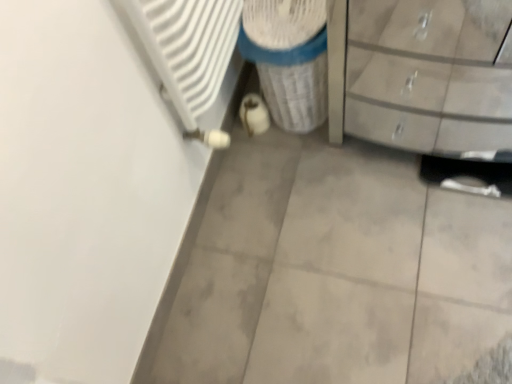
Find the location of a particular element. The image size is (512, 384). white textured cylinder at center is located at coordinates (292, 81).

Measure the distance between point (269, 99) and camera.

A distance of 1.59 meters exists between point (269, 99) and camera.

The height and width of the screenshot is (384, 512). What do you see at coordinates (292, 81) in the screenshot?
I see `white textured cylinder at center` at bounding box center [292, 81].

The width and height of the screenshot is (512, 384). What do you see at coordinates (423, 75) in the screenshot?
I see `matte gray chest of drawers at right` at bounding box center [423, 75].

Find the location of a particular element. This screenshot has width=512, height=384. matte gray chest of drawers at right is located at coordinates (423, 75).

The width and height of the screenshot is (512, 384). What are the coordinates of `white textured cylinder at center` in the screenshot? It's located at (292, 81).

Does matte gray chest of drawers at right appear on the right side of white textured cylinder at center?

Correct, you'll find matte gray chest of drawers at right to the right of white textured cylinder at center.

Does matte gray chest of drawers at right come behind white textured cylinder at center?

No, matte gray chest of drawers at right is closer to the viewer.

Which is in front, point (420, 18) or point (267, 63)?

Point (267, 63)

From the image's perspective, is matte gray chest of drawers at right over white textured cylinder at center?

No.

From a real-world perspective, which object stands above the other?

matte gray chest of drawers at right.

Is matte gray chest of drawers at right thinner than white textured cylinder at center?

Incorrect, the width of matte gray chest of drawers at right is not less than that of white textured cylinder at center.

Does matte gray chest of drawers at right have a lesser height compared to white textured cylinder at center?

In fact, matte gray chest of drawers at right may be taller than white textured cylinder at center.

Can you confirm if matte gray chest of drawers at right is bigger than white textured cylinder at center?

Correct, matte gray chest of drawers at right is larger in size than white textured cylinder at center.

Is matte gray chest of drawers at right not inside white textured cylinder at center?

Yes.

Is matte gray chest of drawers at right next to white textured cylinder at center?

No, matte gray chest of drawers at right is not touching white textured cylinder at center.

Is matte gray chest of drawers at right oriented towards white textured cylinder at center?

No, matte gray chest of drawers at right is not oriented towards white textured cylinder at center.

The height and width of the screenshot is (384, 512). Identify the location of chest of drawers below the white textured cylinder at center (from the image's perspective). (423, 75).

Would you say white textured cylinder at center is to the left or to the right of matte gray chest of drawers at right in the picture?

Based on their positions, white textured cylinder at center is located to the left of matte gray chest of drawers at right.

Does white textured cylinder at center lie in front of matte gray chest of drawers at right?

No, white textured cylinder at center is behind matte gray chest of drawers at right.

Is point (270, 86) closer or farther from the camera than point (442, 48)?

Point (270, 86) is closer to the camera than point (442, 48).

From the image's perspective, would you say white textured cylinder at center is positioned over matte gray chest of drawers at right?

Yes, from the image's perspective, white textured cylinder at center is over matte gray chest of drawers at right.

From a real-world perspective, does white textured cylinder at center stand above matte gray chest of drawers at right?

No, from a real-world perspective, white textured cylinder at center is not over matte gray chest of drawers at right

Between white textured cylinder at center and matte gray chest of drawers at right, which one has larger width?

Wider between the two is matte gray chest of drawers at right.

Is white textured cylinder at center taller than matte gray chest of drawers at right?

No.

Between white textured cylinder at center and matte gray chest of drawers at right, which one has smaller size?

With smaller size is white textured cylinder at center.

Can matte gray chest of drawers at right be found inside white textured cylinder at center?

No, white textured cylinder at center does not contain matte gray chest of drawers at right.

Would you say white textured cylinder at center is a long distance from matte gray chest of drawers at right?

No, there isn't a large distance between white textured cylinder at center and matte gray chest of drawers at right.

Is white textured cylinder at center turned away from matte gray chest of drawers at right?

white textured cylinder at center does not have its back to matte gray chest of drawers at right.

How many degrees apart are the facing directions of white textured cylinder at center and matte gray chest of drawers at right?

The angle between the facing direction of white textured cylinder at center and the facing direction of matte gray chest of drawers at right is 0.357 degrees.

Measure the distance between white textured cylinder at center and matte gray chest of drawers at right.

12.74 inches.

The width and height of the screenshot is (512, 384). I want to click on recycling bin on the left of matte gray chest of drawers at right, so click(x=292, y=81).

Identify the location of the chest of drawers that is below the white textured cylinder at center (from the image's perspective). The height and width of the screenshot is (384, 512). (423, 75).

Where is `chest of drawers above the white textured cylinder at center (from a real-world perspective)`? chest of drawers above the white textured cylinder at center (from a real-world perspective) is located at coordinates (423, 75).